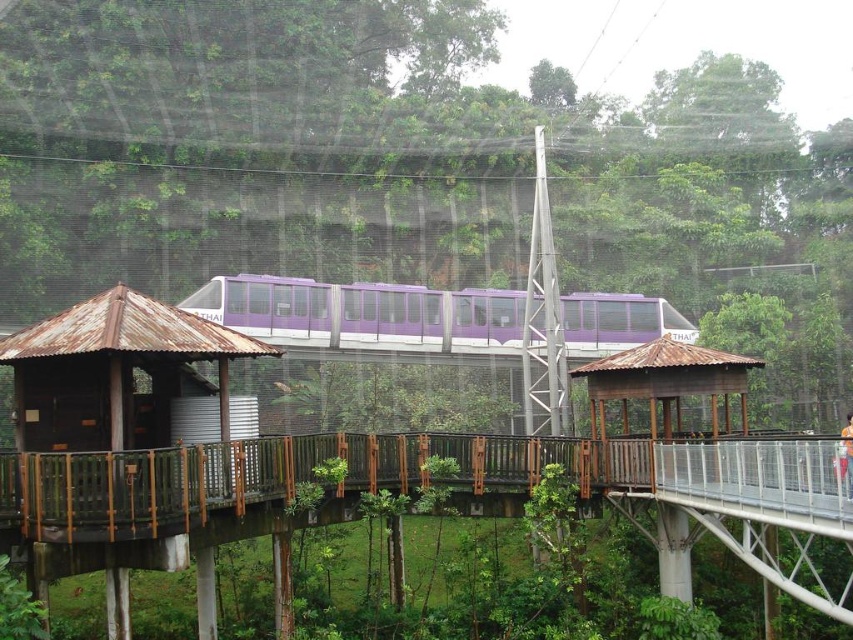
Question: Does rusty wood hut at left lie in front of purple matte train at center?

Choices:
 (A) yes
 (B) no

Answer: (A)

Question: Does wooden at center have a larger size compared to brown wooden gazebo at center?

Choices:
 (A) yes
 (B) no

Answer: (A)

Question: Estimate the real-world distances between objects in this image. Which object is farther from the brown wooden gazebo at center?

Choices:
 (A) wooden at center
 (B) rusty wood hut at left

Answer: (B)

Question: Can you confirm if purple matte train at center is thinner than brown wooden gazebo at center?

Choices:
 (A) no
 (B) yes

Answer: (A)

Question: Which point is farther to the camera?

Choices:
 (A) rusty wood hut at left
 (B) purple matte train at center
 (C) wooden at center

Answer: (B)

Question: Among these points, which one is farthest from the camera?

Choices:
 (A) (140, 339)
 (B) (497, 339)
 (C) (670, 417)
 (D) (293, 472)

Answer: (B)